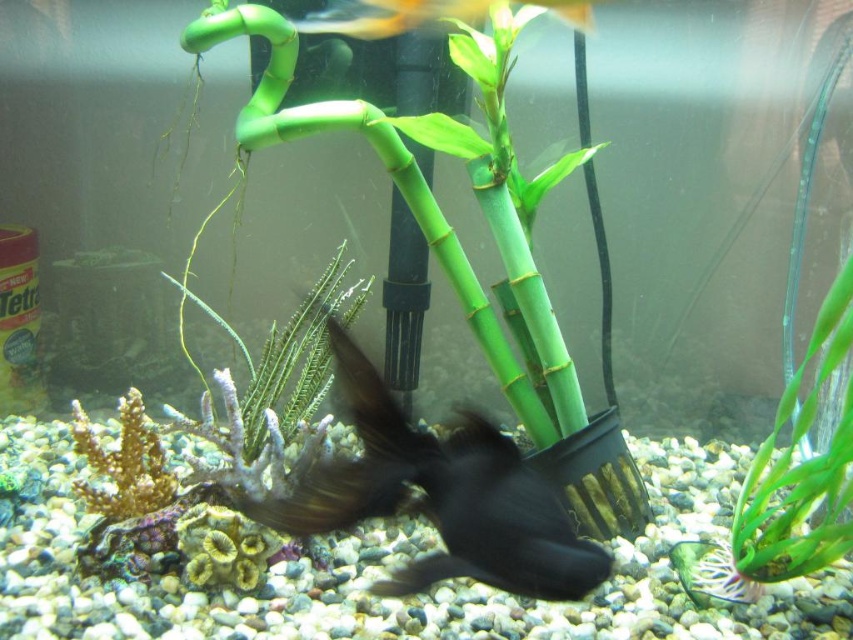
Question: Which point appears farthest from the camera in this image?

Choices:
 (A) (146, 502)
 (B) (422, 22)
 (C) (476, 476)
 (D) (776, 477)

Answer: (B)

Question: Which object is farther from the camera taking this photo?

Choices:
 (A) green matte plant at right
 (B) black matte fish at center
 (C) green matte plant at center

Answer: (C)

Question: Estimate the real-world distances between objects in this image. Which object is farther from the orange coral at lower left?

Choices:
 (A) black matte fish at center
 (B) green matte plant at center
 (C) translucent yellow fish at upper center

Answer: (C)

Question: Does green matte plant at right have a larger size compared to orange coral at lower left?

Choices:
 (A) yes
 (B) no

Answer: (A)

Question: Does green matte plant at right appear under green matte plant at center?

Choices:
 (A) no
 (B) yes

Answer: (B)

Question: Does green matte plant at right appear on the right side of green matte plant at center?

Choices:
 (A) yes
 (B) no

Answer: (A)